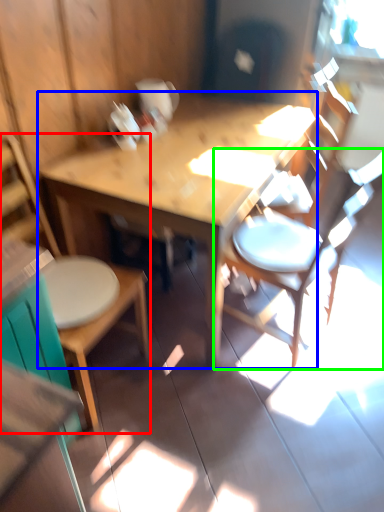
Question: Based on their relative distances, which object is nearer to chair (highlighted by a red box)? Choose from table (highlighted by a blue box) and chair (highlighted by a green box).

Choices:
 (A) table
 (B) chair

Answer: (A)